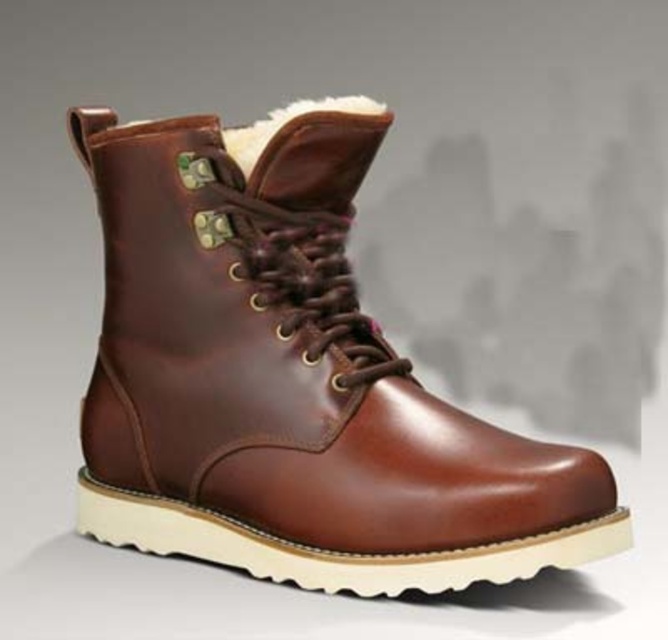
Question: Among these points, which one is nearest to the camera?

Choices:
 (A) (311, 102)
 (B) (112, 376)

Answer: (A)

Question: Which object is farther from the camera taking this photo?

Choices:
 (A) brown leather boot at center
 (B) white fluffy fur at upper center

Answer: (B)

Question: Is brown leather boot at center smaller than white fluffy fur at upper center?

Choices:
 (A) yes
 (B) no

Answer: (B)

Question: In this image, where is brown leather boot at center located relative to white fluffy fur at upper center?

Choices:
 (A) left
 (B) right

Answer: (A)

Question: Does brown leather boot at center have a lesser width compared to white fluffy fur at upper center?

Choices:
 (A) yes
 (B) no

Answer: (B)

Question: Which point is closer to the camera?

Choices:
 (A) (248, 193)
 (B) (283, 118)

Answer: (A)